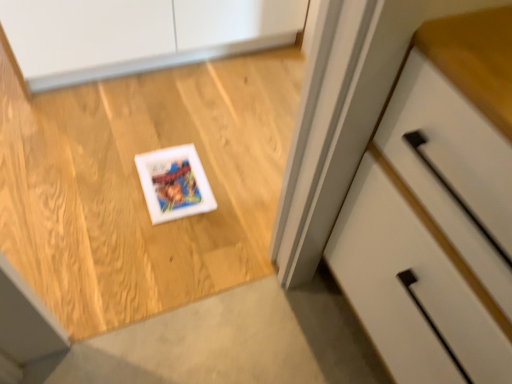
The height and width of the screenshot is (384, 512). Describe the element at coordinates (174, 183) in the screenshot. I see `white glossy comic book at center` at that location.

This screenshot has height=384, width=512. Identify the location of white glossy comic book at center. (174, 183).

Find the location of a particular element. Image resolution: width=512 pixels, height=384 pixels. white glossy comic book at center is located at coordinates (174, 183).